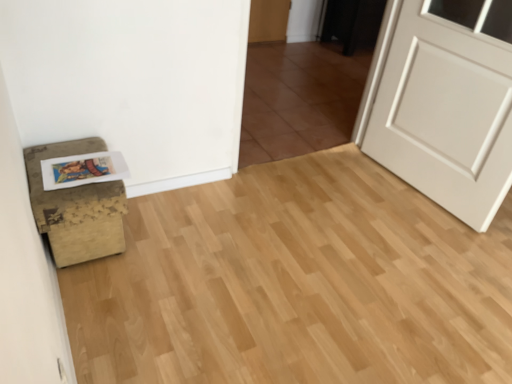
Where is `vacant region to the left of white matte door at right`? vacant region to the left of white matte door at right is located at coordinates (342, 192).